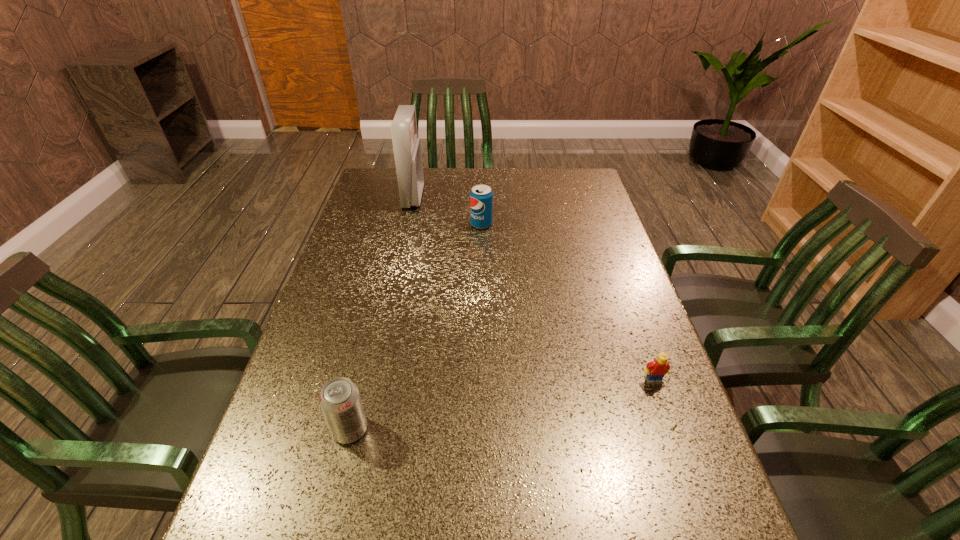
Locate an element on the screen. the first-aid kit is located at coordinates (406, 145).

Locate an element on the screen. The image size is (960, 540). the tallest object is located at coordinates (406, 145).

This screenshot has height=540, width=960. I want to click on the right soda can, so click(x=481, y=196).

Image resolution: width=960 pixels, height=540 pixels. Find the location of `the farther soda can`. the farther soda can is located at coordinates (481, 196).

At what (x,y) coordinates should I click in order to perform the action: click on the left soda can. Please return your answer as a coordinate pair (x, y). Image resolution: width=960 pixels, height=540 pixels. Looking at the image, I should click on (x=340, y=401).

In order to click on the nearer soda can in this screenshot , I will do `click(340, 401)`.

The height and width of the screenshot is (540, 960). What are the coordinates of `the rightmost object` in the screenshot? It's located at (656, 370).

At what (x,y) coordinates should I click in order to perform the action: click on Lego. Please return your answer as a coordinate pair (x, y). Looking at the image, I should click on (656, 370).

Locate an element on the screen. Image resolution: width=960 pixels, height=540 pixels. free space located 0.200m on the front-facing side of the tallest object is located at coordinates (479, 197).

Locate an element on the screen. Image resolution: width=960 pixels, height=540 pixels. free location located 0.210m on the left of the second farthest object is located at coordinates (406, 225).